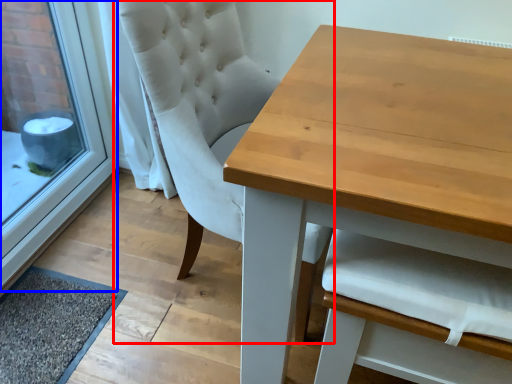
Question: Which object appears closest to the camera in this image, chair (highlighted by a red box) or window frame (highlighted by a blue box)?

Choices:
 (A) chair
 (B) window frame

Answer: (A)